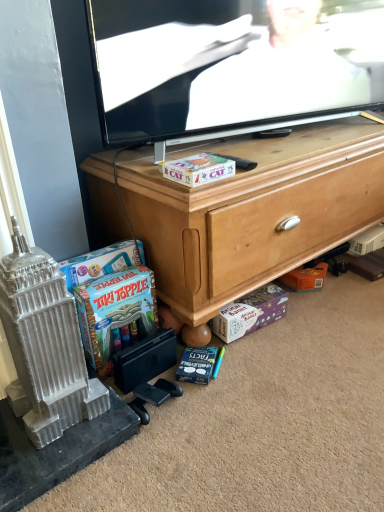
I want to click on vacant area in front of purple cardboard box at lower center, the 3th cash positioned from the left, so click(259, 360).